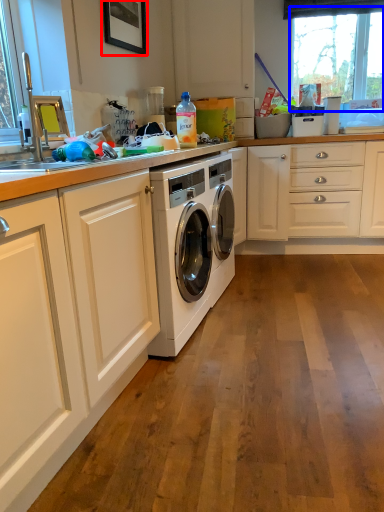
Question: Among these objects, which one is nearest to the camera, picture frame (highlighted by a red box) or window (highlighted by a blue box)?

Choices:
 (A) picture frame
 (B) window

Answer: (A)